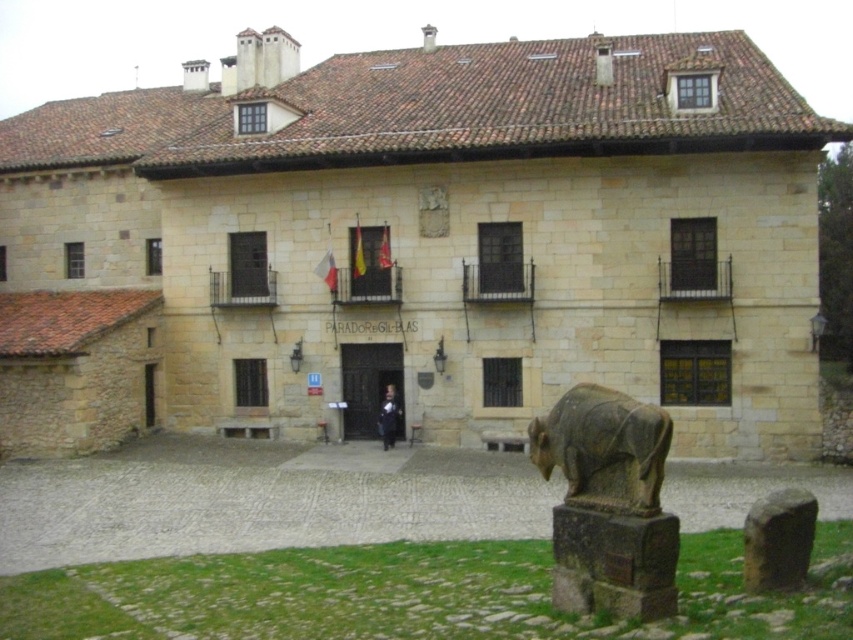
You are standing in front of the PARADOR GIL BLAS building. You see a gray stone bear at lower right and a dark blue fabric coat at center. Which object is taller?

The gray stone bear at lower right is taller than the dark blue fabric coat at center.

You are standing in front of the PARADOR GIL BLAS building and want to take a photo. You notice two points marked on the building. Which point is closer to you, point (635,513) or point (393,428)?

Point (635,513) is closer to the viewer than point (393,428).

You are standing at the entrance of the PARADOR GIL BLAS building and want to place a small flowerpot between the gray stone bear at lower right and the dark blue fabric coat at center. Which object should you place the flowerpot closer to if you want it to be nearer to the entrance?

The gray stone bear at lower right is closer to the viewer than the dark blue fabric coat at center, so placing the flowerpot closer to the gray stone bear at lower right would make it nearer to the entrance.